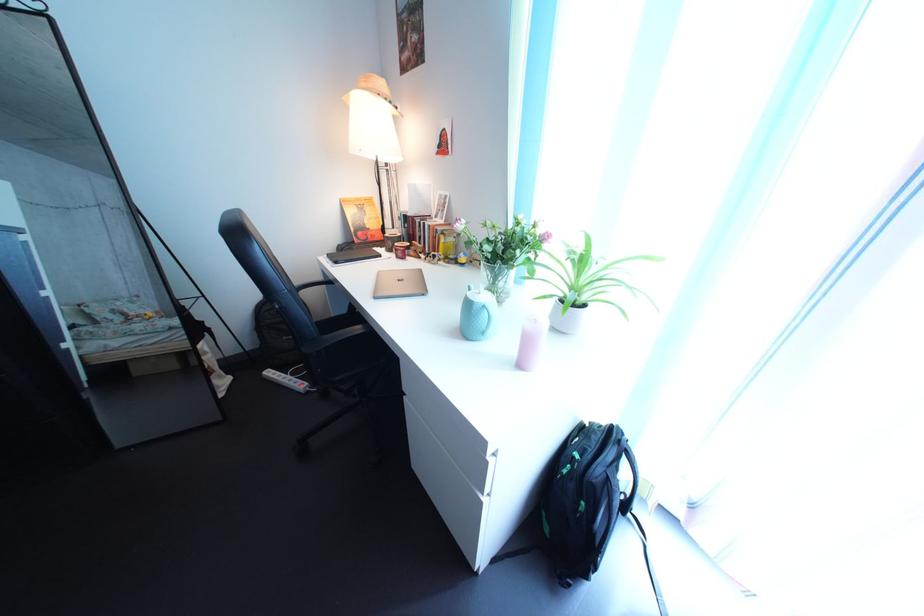
Locate an element on the screen. backpack top handle is located at coordinates (612, 454).